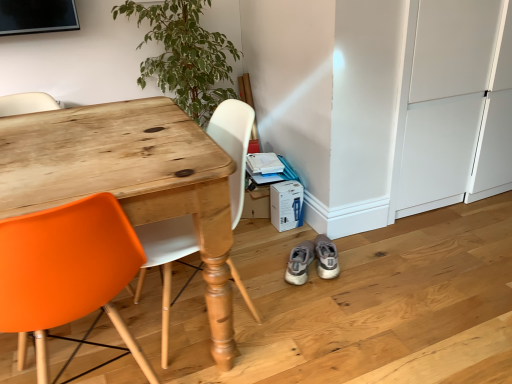
Find the location of `free space above white cardboard box at lower center (from a real-world perspective)`. free space above white cardboard box at lower center (from a real-world perspective) is located at coordinates (280, 178).